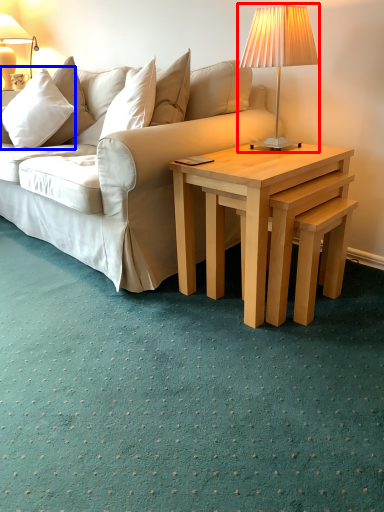
Question: Which object is closer to the camera taking this photo, lamp (highlighted by a red box) or pillow (highlighted by a blue box)?

Choices:
 (A) lamp
 (B) pillow

Answer: (A)